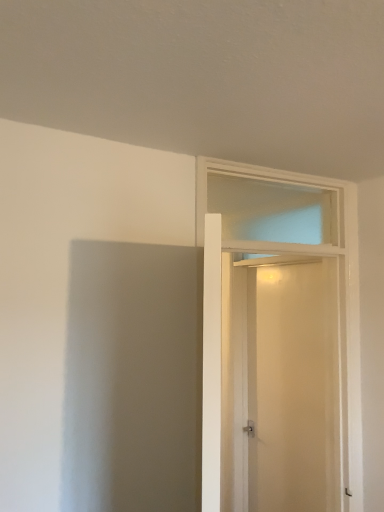
What do you see at coordinates (294, 387) in the screenshot? The width and height of the screenshot is (384, 512). I see `beige matte screen door at center` at bounding box center [294, 387].

Locate an element on the screen. beige matte screen door at center is located at coordinates [x=294, y=387].

What do you see at coordinates (279, 340) in the screenshot? Image resolution: width=384 pixels, height=512 pixels. I see `white glossy door at center` at bounding box center [279, 340].

Measure the distance between white glossy door at center and camera.

A distance of 1.46 meters exists between white glossy door at center and camera.

I want to click on white glossy door at center, so click(x=279, y=340).

Where is `beige matte screen door at center`? beige matte screen door at center is located at coordinates coord(294,387).

Visually, is white glossy door at center positioned to the left or to the right of beige matte screen door at center?

From the image, it's evident that white glossy door at center is to the left of beige matte screen door at center.

Which object is further away from the camera taking this photo, white glossy door at center or beige matte screen door at center?

beige matte screen door at center.

Considering the positions of point (212, 257) and point (315, 457), is point (212, 257) closer or farther from the camera than point (315, 457)?

Point (212, 257) appears to be closer to the viewer than point (315, 457).

From the image's perspective, relative to beige matte screen door at center, is white glossy door at center above or below?

white glossy door at center is above beige matte screen door at center.

From a real-world perspective, is white glossy door at center above or below beige matte screen door at center?

Clearly, from a real-world perspective, white glossy door at center is above beige matte screen door at center.

In terms of width, does white glossy door at center look wider or thinner when compared to beige matte screen door at center?

Considering their sizes, white glossy door at center looks broader than beige matte screen door at center.

Is white glossy door at center taller or shorter than beige matte screen door at center?

Clearly, white glossy door at center is shorter compared to beige matte screen door at center.

Considering the sizes of white glossy door at center and beige matte screen door at center in the image, is white glossy door at center bigger or smaller than beige matte screen door at center?

white glossy door at center is bigger than beige matte screen door at center.

Is white glossy door at center completely or partially outside of beige matte screen door at center?

white glossy door at center is positioned outside beige matte screen door at center.

Is there a large distance between white glossy door at center and beige matte screen door at center?

white glossy door at center is near beige matte screen door at center, not far away.

Does white glossy door at center turn towards beige matte screen door at center?

No.

Image resolution: width=384 pixels, height=512 pixels. In order to click on door located in front of the beige matte screen door at center in this screenshot , I will do `click(279, 340)`.

Visually, is beige matte screen door at center positioned to the left or to the right of white glossy door at center?

From the image, it's evident that beige matte screen door at center is to the right of white glossy door at center.

Between beige matte screen door at center and white glossy door at center, which one is positioned behind?

beige matte screen door at center is further away from the camera.

Between point (281, 403) and point (230, 438), which one is positioned behind?

The point (230, 438) is farther.

From the image's perspective, which is below, beige matte screen door at center or white glossy door at center?

beige matte screen door at center.

From a real-world perspective, which object rests below the other?

beige matte screen door at center is physically lower.

Which object is thinner, beige matte screen door at center or white glossy door at center?

beige matte screen door at center.

Does beige matte screen door at center have a lesser height compared to white glossy door at center?

No, beige matte screen door at center is not shorter than white glossy door at center.

From the picture: Who is bigger, beige matte screen door at center or white glossy door at center?

white glossy door at center is bigger.

Is beige matte screen door at center completely or partially outside of white glossy door at center?

Yes, beige matte screen door at center is outside of white glossy door at center.

Is beige matte screen door at center placed right next to white glossy door at center?

Yes, beige matte screen door at center is beside white glossy door at center.

Is white glossy door at center at the back of beige matte screen door at center?

That's not correct — beige matte screen door at center is not looking away from white glossy door at center.

In the scene shown: How many degrees apart are the facing directions of beige matte screen door at center and white glossy door at center?

89.1 degrees.

Where is `door above the beige matte screen door at center (from the image's perspective)`? The width and height of the screenshot is (384, 512). door above the beige matte screen door at center (from the image's perspective) is located at coordinates (279, 340).

At what (x,y) coordinates should I click in order to perform the action: click on screen door behind the white glossy door at center. Please return your answer as a coordinate pair (x, y). The height and width of the screenshot is (512, 384). Looking at the image, I should click on (294, 387).

Locate an element on the screen. The height and width of the screenshot is (512, 384). screen door below the white glossy door at center (from the image's perspective) is located at coordinates (294, 387).